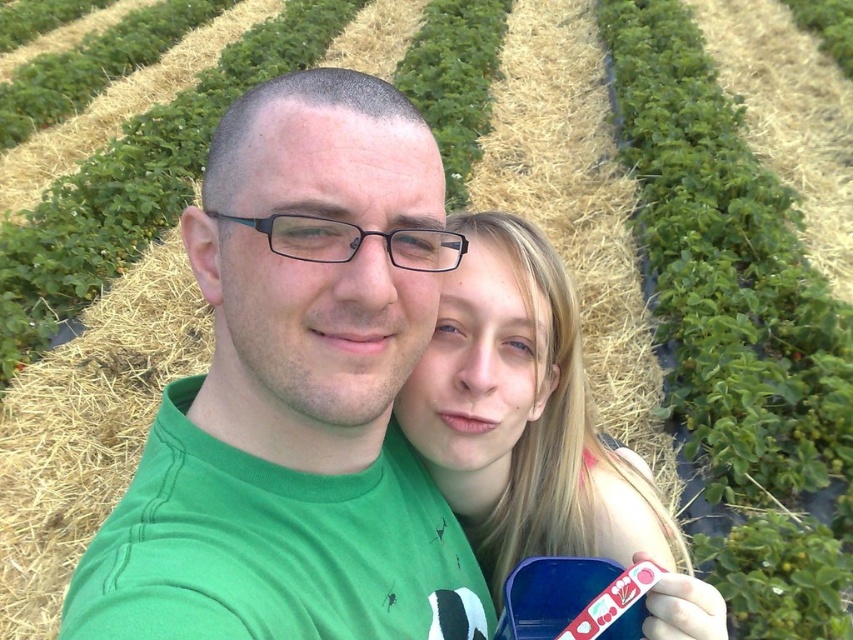
Question: Does green matte t-shirt at center appear on the left side of blonde hair at center?

Choices:
 (A) no
 (B) yes

Answer: (B)

Question: Considering the relative positions of green matte t-shirt at center and blonde hair at center in the image provided, where is green matte t-shirt at center located with respect to blonde hair at center?

Choices:
 (A) above
 (B) below

Answer: (A)

Question: Which point is farther from the camera taking this photo?

Choices:
 (A) (408, 396)
 (B) (247, 516)

Answer: (A)

Question: Can you confirm if green matte t-shirt at center is positioned above blonde hair at center?

Choices:
 (A) yes
 (B) no

Answer: (A)

Question: Which object appears closest to the camera in this image?

Choices:
 (A) blonde hair at center
 (B) green matte t-shirt at center

Answer: (B)